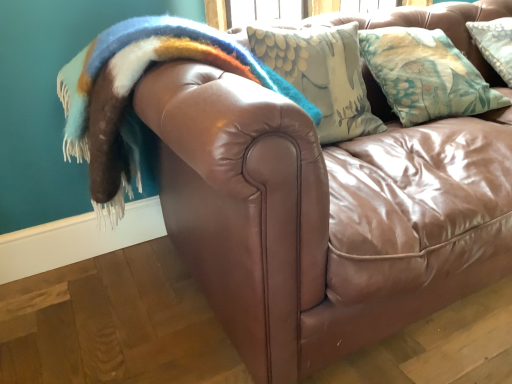
Question: From the image's perspective, is fuzzy woolen blanket at upper left above or below floral fabric pillow at upper right?

Choices:
 (A) below
 (B) above

Answer: (A)

Question: Considering the positions of fuzzy woolen blanket at upper left and floral fabric pillow at upper right in the image, is fuzzy woolen blanket at upper left bigger or smaller than floral fabric pillow at upper right?

Choices:
 (A) small
 (B) big

Answer: (B)

Question: Is fuzzy woolen blanket at upper left in front of or behind floral fabric pillow at upper right in the image?

Choices:
 (A) behind
 (B) front

Answer: (B)

Question: Looking at the image, does floral fabric pillow at upper right seem bigger or smaller compared to fuzzy woolen blanket at upper left?

Choices:
 (A) small
 (B) big

Answer: (A)

Question: Relative to fuzzy woolen blanket at upper left, is floral fabric pillow at upper right in front or behind?

Choices:
 (A) front
 (B) behind

Answer: (B)

Question: Is point (495, 104) positioned closer to the camera than point (150, 23)?

Choices:
 (A) farther
 (B) closer

Answer: (A)

Question: From their relative heights in the image, would you say floral fabric pillow at upper right is taller or shorter than fuzzy woolen blanket at upper left?

Choices:
 (A) tall
 (B) short

Answer: (B)